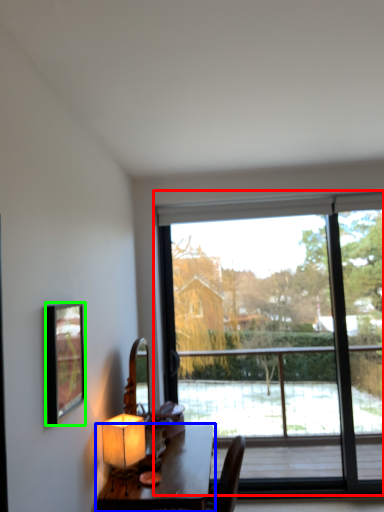
Question: Which object is positioned farthest from window (highlighted by a red box)? Select from table (highlighted by a blue box) and picture frame (highlighted by a green box).

Choices:
 (A) table
 (B) picture frame

Answer: (B)